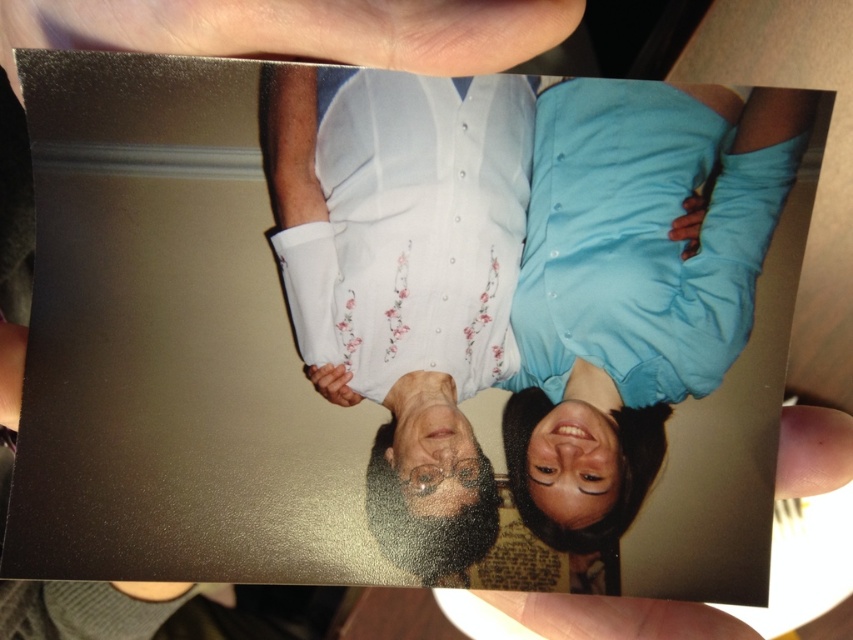
How far apart are white floral shirt at center and smooth skin hand at lower center?

white floral shirt at center is 7.22 inches away from smooth skin hand at lower center.

Who is positioned more to the right, white floral shirt at center or smooth skin hand at lower center?

Positioned to the right is smooth skin hand at lower center.

I want to click on white floral shirt at center, so click(524, 262).

Who is higher up, white floral shirt at center or metallic silver hand at upper center?

Positioned higher is metallic silver hand at upper center.

Is white floral shirt at center positioned behind metallic silver hand at upper center?

Yes, it is behind metallic silver hand at upper center.

Identify the location of white floral shirt at center. (524, 262).

Identify the location of metallic silver hand at upper center. (299, 29).

Is point (149, 42) more distant than point (630, 611)?

No, (149, 42) is closer to viewer.

Locate an element on the screen. This screenshot has height=640, width=853. metallic silver hand at upper center is located at coordinates (299, 29).